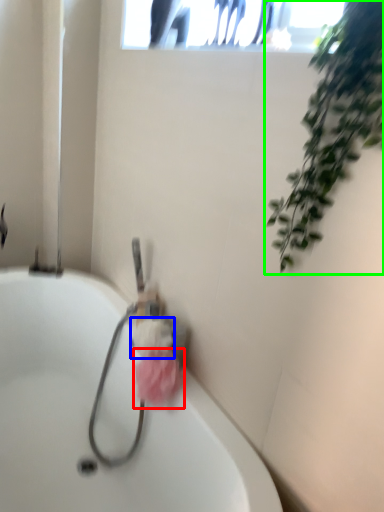
Question: Based on their relative distances, which object is nearer to flower (highlighted by a red box)? Choose from flower (highlighted by a blue box) and houseplant (highlighted by a green box).

Choices:
 (A) flower
 (B) houseplant

Answer: (A)